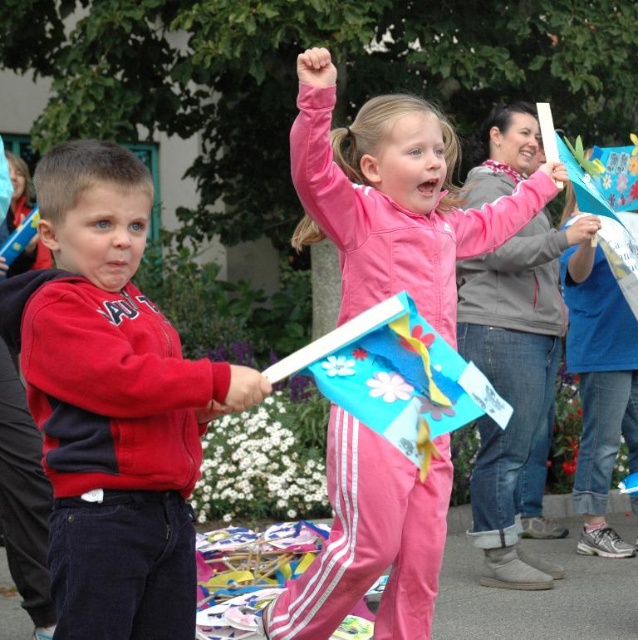
Is red fleece jacket at left to the right of pink matte flag at center from the viewer's perspective?

In fact, red fleece jacket at left is to the left of pink matte flag at center.

From the picture: Is red fleece jacket at left positioned before pink matte flag at center?

Yes, red fleece jacket at left is in front of pink matte flag at center.

This screenshot has height=640, width=638. Describe the element at coordinates (112, 403) in the screenshot. I see `red fleece jacket at left` at that location.

Where is `red fleece jacket at left`? The width and height of the screenshot is (638, 640). red fleece jacket at left is located at coordinates (112, 403).